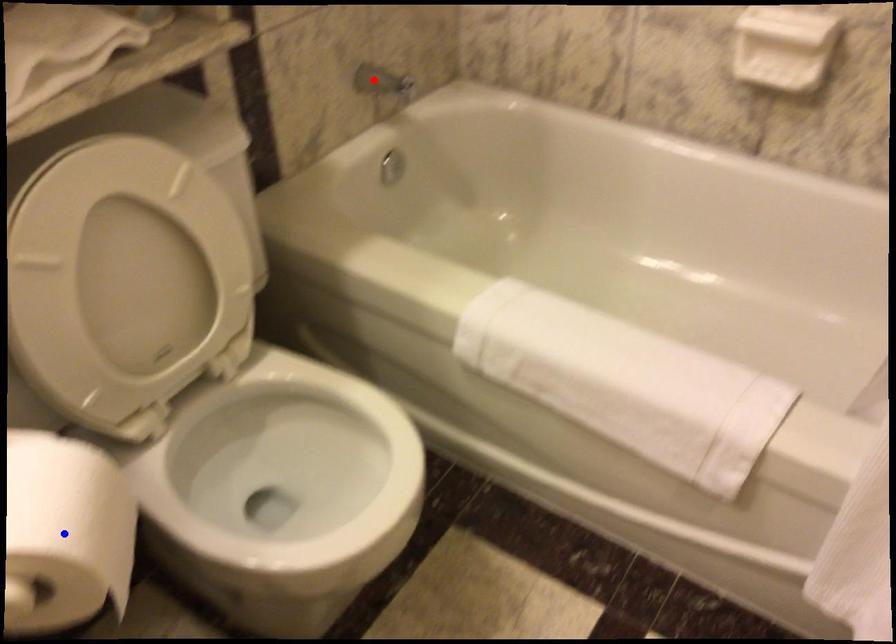
Question: In the image, two points are highlighted. Which point is nearer to the camera? Reply with the corresponding letter.

Choices:
 (A) blue point
 (B) red point

Answer: (A)